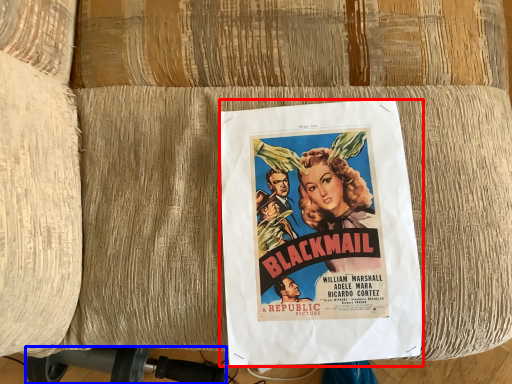
Question: Which of the following is the closest to the observer, poster (highlighted by a red box) or vacuum (highlighted by a blue box)?

Choices:
 (A) poster
 (B) vacuum

Answer: (A)